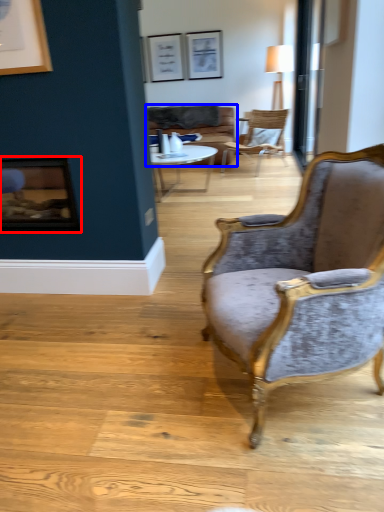
Question: Which point is further to the camera, fireplace (highlighted by a red box) or studio couch (highlighted by a blue box)?

Choices:
 (A) fireplace
 (B) studio couch

Answer: (B)